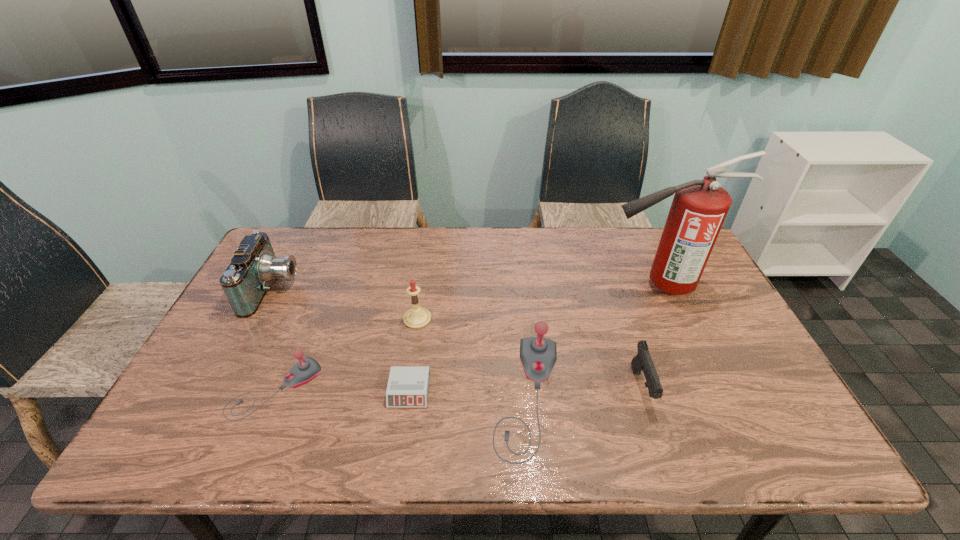
Please point a free position for a joystick on the right. Please provide its 2D coordinates. Your answer should be formatted as a tuple, i.e. [(x, y)], where the tuple contains the x and y coordinates of a point satisfying the conditions above.

[(786, 404)]